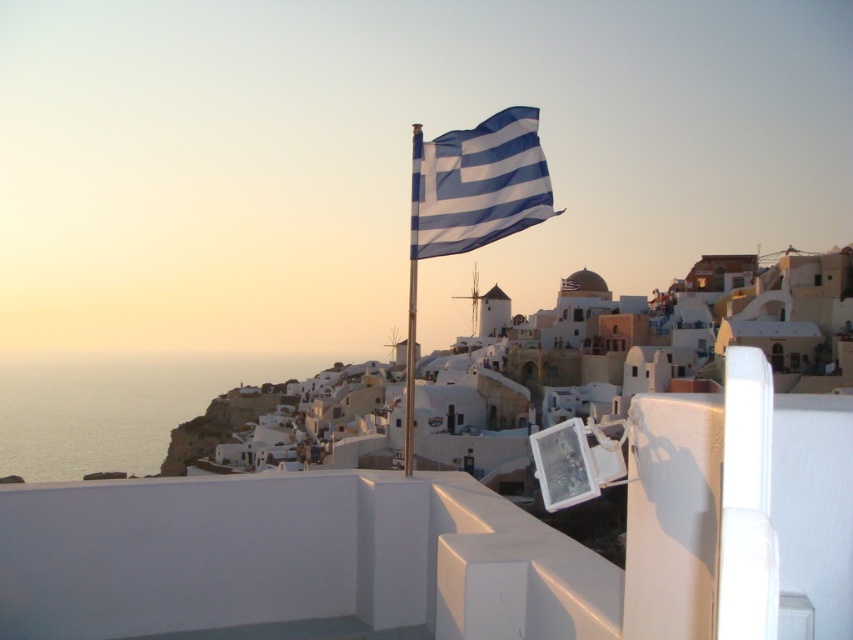
Between white matte building at center and metallic silver flag pole at center, which one appears on the left side from the viewer's perspective?

metallic silver flag pole at center is more to the left.

Is white matte building at center positioned behind metallic silver flag pole at center?

Yes, white matte building at center is further from the viewer.

Which is behind, point (811, 298) or point (405, 364)?

The point (811, 298) is behind.

The height and width of the screenshot is (640, 853). What are the coordinates of `white matte building at center` in the screenshot? It's located at (624, 360).

Which is below, blue and white striped flag at center or metallic silver flag pole at center?

metallic silver flag pole at center is below.

Which is in front, point (534, 189) or point (408, 323)?

Point (534, 189)

The width and height of the screenshot is (853, 640). Identify the location of blue and white striped flag at center. (477, 184).

Does point (569, 326) come in front of point (469, 243)?

No, (569, 326) is further to viewer.

Does point (744, 317) lie in front of point (431, 211)?

No, it is behind (431, 211).

Locate an element on the screen. The image size is (853, 640). white matte building at center is located at coordinates (624, 360).